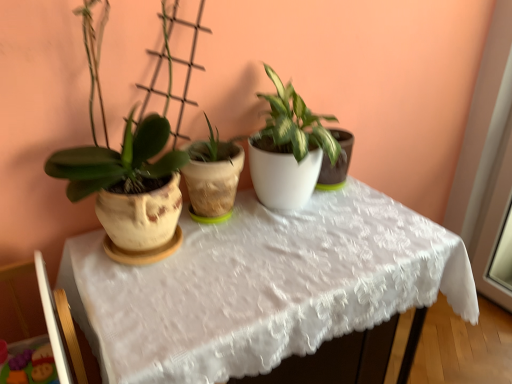
Question: From the image's perspective, is white lace tablecloth at center under matte clay pot at left?

Choices:
 (A) no
 (B) yes

Answer: (B)

Question: Is white lace tablecloth at center wider than matte clay pot at left?

Choices:
 (A) yes
 (B) no

Answer: (A)

Question: Does white lace tablecloth at center have a lesser width compared to matte clay pot at left?

Choices:
 (A) no
 (B) yes

Answer: (A)

Question: Is white lace tablecloth at center positioned far away from matte clay pot at left?

Choices:
 (A) no
 (B) yes

Answer: (A)

Question: Is white lace tablecloth at center located outside matte clay pot at left?

Choices:
 (A) no
 (B) yes

Answer: (B)

Question: From a real-world perspective, is white lace tablecloth at center physically above matte clay pot at left?

Choices:
 (A) no
 (B) yes

Answer: (A)

Question: Considering the relative sizes of matte clay pot at left and white lace tablecloth at center in the image provided, is matte clay pot at left smaller than white lace tablecloth at center?

Choices:
 (A) yes
 (B) no

Answer: (A)

Question: Is matte clay pot at left facing away from white lace tablecloth at center?

Choices:
 (A) no
 (B) yes

Answer: (A)

Question: Considering the relative sizes of matte clay pot at left and white lace tablecloth at center in the image provided, is matte clay pot at left wider than white lace tablecloth at center?

Choices:
 (A) no
 (B) yes

Answer: (A)

Question: From a real-world perspective, is matte clay pot at left on top of white lace tablecloth at center?

Choices:
 (A) yes
 (B) no

Answer: (A)

Question: Is white lace tablecloth at center a part of matte clay pot at left?

Choices:
 (A) no
 (B) yes

Answer: (A)

Question: Is matte clay pot at left positioned beyond the bounds of white lace tablecloth at center?

Choices:
 (A) yes
 (B) no

Answer: (A)

Question: Relative to white lace tablecloth at center, is matte clay pot at left in front or behind?

Choices:
 (A) front
 (B) behind

Answer: (A)